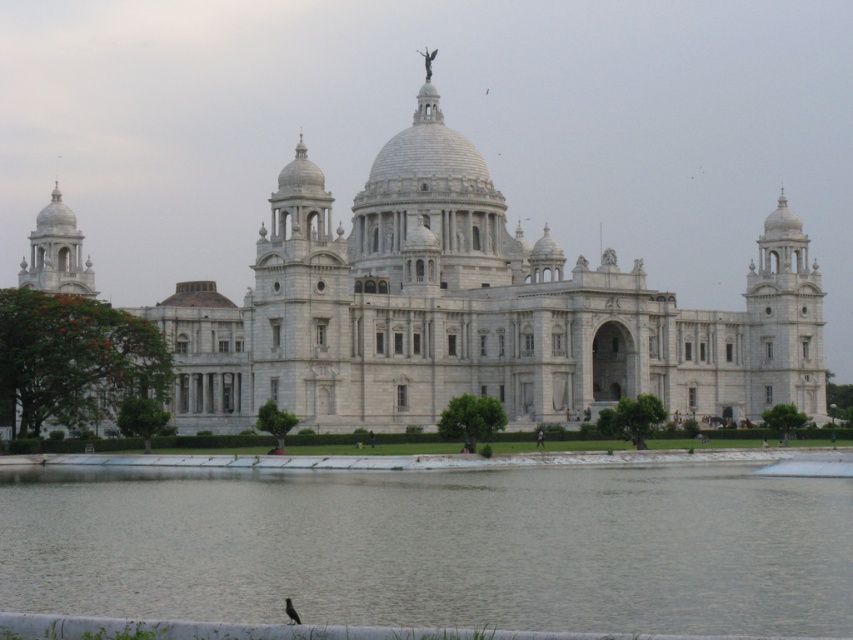
Image resolution: width=853 pixels, height=640 pixels. Identify the location of gray concrete water at center. (436, 547).

Can you confirm if gray concrete water at center is positioned to the right of brown feathered bird at lower center?

Indeed, gray concrete water at center is positioned on the right side of brown feathered bird at lower center.

The height and width of the screenshot is (640, 853). In order to click on gray concrete water at center in this screenshot , I will do `click(436, 547)`.

Who is positioned more to the right, white marble palace at center or brown feathered bird at lower center?

brown feathered bird at lower center is more to the right.

Which is more to the left, white marble palace at center or brown feathered bird at lower center?

From the viewer's perspective, white marble palace at center appears more on the left side.

Between point (425, 298) and point (294, 621), which one is positioned behind?

The point (425, 298) is behind.

Locate an element on the screen. The height and width of the screenshot is (640, 853). white marble palace at center is located at coordinates (473, 310).

Between gray concrete water at center and white marble palace at center, which one appears on the left side from the viewer's perspective?

From the viewer's perspective, white marble palace at center appears more on the left side.

Is point (88, 522) positioned behind point (746, 364)?

No, it is not.

Is point (369, 586) farther from camera compared to point (368, 243)?

No, (369, 586) is in front of (368, 243).

Where is `gray concrete water at center`? This screenshot has height=640, width=853. gray concrete water at center is located at coordinates click(x=436, y=547).